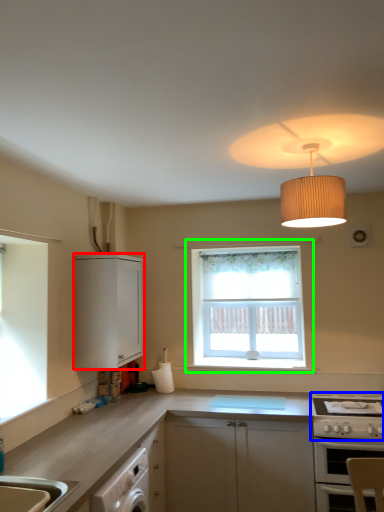
Question: Which is farther away from cabinetry (highlighted by a red box)? gas stove (highlighted by a blue box) or window (highlighted by a green box)?

Choices:
 (A) gas stove
 (B) window

Answer: (A)